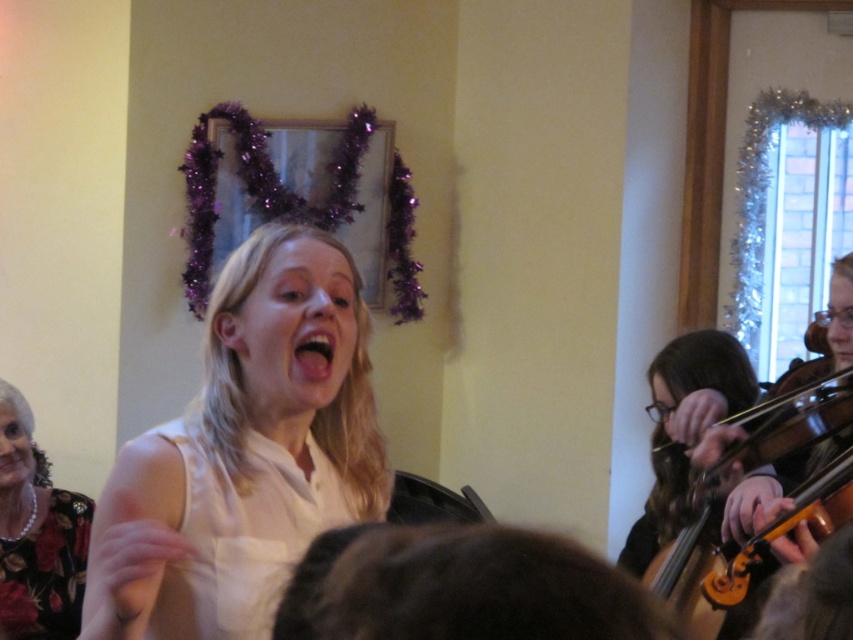
Question: Observing the image, what is the correct spatial positioning of white matte shirt at center in reference to white satin dress at center?

Choices:
 (A) above
 (B) below

Answer: (A)

Question: Which point is farther to the camera?

Choices:
 (A) black floral dress at lower left
 (B) white matte shirt at center

Answer: (A)

Question: Can you confirm if white satin dress at center is wider than black floral dress at lower left?

Choices:
 (A) no
 (B) yes

Answer: (B)

Question: Which object appears closest to the camera in this image?

Choices:
 (A) white satin dress at center
 (B) white matte shirt at center
 (C) black floral dress at lower left

Answer: (A)

Question: Can you confirm if wooden violin at right is positioned above black floral dress at lower left?

Choices:
 (A) yes
 (B) no

Answer: (A)

Question: Which point is closer to the camera?

Choices:
 (A) wooden violin at right
 (B) white matte shirt at center

Answer: (B)